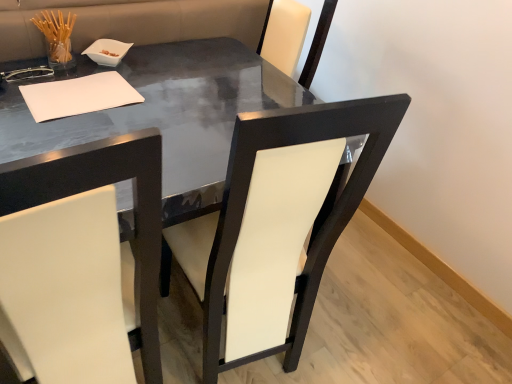
Where is `free spot to the left of white paper at upper left`? The image size is (512, 384). free spot to the left of white paper at upper left is located at coordinates (25, 84).